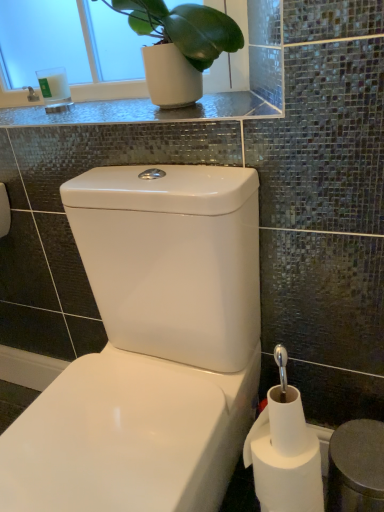
Describe the element at coordinates (55, 89) in the screenshot. I see `white glass candle at upper left` at that location.

You are a GUI agent. You are given a task and a screenshot of the screen. Output one action in this format:
    pyautogui.click(x=<x>, y=<y>)
    Task: Click on the white glossy toilet at center
    The width and height of the screenshot is (384, 512).
    Given the screenshot: What is the action you would take?
    pyautogui.click(x=150, y=347)

The width and height of the screenshot is (384, 512). Describe the element at coordinates (150, 347) in the screenshot. I see `white glossy toilet at center` at that location.

Locate an element on the screen. white matte toilet paper at lower right is located at coordinates click(284, 469).

Identify the location of white glass candle at upper left. (55, 89).

Between white matte toilet paper at lower right and green matte plant at upper left, which one has smaller size?

white matte toilet paper at lower right.

Considering the positions of objects white matte toilet paper at lower right and green matte plant at upper left in the image provided, who is behind, white matte toilet paper at lower right or green matte plant at upper left?

green matte plant at upper left is behind.

At what (x,y) coordinates should I click in order to perform the action: click on toilet paper on the right of green matte plant at upper left. Please return your answer as a coordinate pair (x, y). This screenshot has width=384, height=512. Looking at the image, I should click on (284, 469).

Looking at this image, considering the sizes of objects white glossy toilet at center and white glass candle at upper left in the image provided, who is wider, white glossy toilet at center or white glass candle at upper left?

With larger width is white glossy toilet at center.

Considering the relative positions of white glossy toilet at center and white glass candle at upper left in the image provided, is white glossy toilet at center to the right of white glass candle at upper left from the viewer's perspective?

Yes.

From a real-world perspective, which is physically above, white glossy toilet at center or white glass candle at upper left?

white glass candle at upper left is physically above.

Can you confirm if white glossy toilet at center is smaller than white glass candle at upper left?

No, white glossy toilet at center is not smaller than white glass candle at upper left.

Which of these two, white matte toilet paper at lower right or white glossy toilet at center, is smaller?

white matte toilet paper at lower right.

Relative to white glossy toilet at center, is white matte toilet paper at lower right in front or behind?

Visually, white matte toilet paper at lower right is located behind white glossy toilet at center.

From a real-world perspective, who is located lower, white matte toilet paper at lower right or white glossy toilet at center?

From a 3D spatial view, white matte toilet paper at lower right is below.

Is white glossy toilet at center at the back of shiny glass countertop at upper center?

That's not correct — shiny glass countertop at upper center is not looking away from white glossy toilet at center.

Does shiny glass countertop at upper center come behind white glossy toilet at center?

Yes, it is.

Do you think shiny glass countertop at upper center is within white glossy toilet at center, or outside of it?

shiny glass countertop at upper center is spatially situated outside white glossy toilet at center.

From the image's perspective, is shiny glass countertop at upper center located beneath white glossy toilet at center?

Actually, shiny glass countertop at upper center appears above white glossy toilet at center in the image.

From a real-world perspective, who is located higher, white glossy toilet at center or shiny glass countertop at upper center?

In real-world perspective, shiny glass countertop at upper center is above.

Which of these two, white glossy toilet at center or shiny glass countertop at upper center, stands shorter?

Standing shorter between the two is shiny glass countertop at upper center.

This screenshot has height=512, width=384. I want to click on counter top on the left of white glossy toilet at center, so click(134, 111).

Is point (80, 431) closer to camera compared to point (173, 116)?

Yes, it is.

Could you tell me if white matte toilet paper at lower right is turned towards white glass candle at upper left?

No, white matte toilet paper at lower right is not turned towards white glass candle at upper left.

Is white matte toilet paper at lower right in contact with white glass candle at upper left?

No.

Considering the sizes of objects white matte toilet paper at lower right and white glass candle at upper left in the image provided, who is thinner, white matte toilet paper at lower right or white glass candle at upper left?

white glass candle at upper left.

From a real-world perspective, which object stands above the other?

green matte plant at upper left is physically above.

Is point (257, 106) farther from camera compared to point (241, 34)?

No, it is not.

Is shiny glass countertop at upper center facing towards green matte plant at upper left?

No, shiny glass countertop at upper center is not oriented towards green matte plant at upper left.

Locate an element on the screen. The height and width of the screenshot is (512, 384). houseplant that is on the right side of shiny glass countertop at upper center is located at coordinates (181, 39).

Locate an element on the screen. This screenshot has height=512, width=384. houseplant on the left of white matte toilet paper at lower right is located at coordinates (181, 39).

Locate an element on the screen. toilet located on the right of white glass candle at upper left is located at coordinates (150, 347).

When comparing their distances from white matte toilet paper at lower right, does shiny glass countertop at upper center or green matte plant at upper left seem further?

green matte plant at upper left lies further to white matte toilet paper at lower right than the other object.

From the image, which object appears to be nearer to white glossy toilet at center, shiny glass countertop at upper center or white matte toilet paper at lower right?

Based on the image, white matte toilet paper at lower right appears to be nearer to white glossy toilet at center.

Considering their positions, is green matte plant at upper left positioned closer to white matte toilet paper at lower right than white glass candle at upper left?

green matte plant at upper left is closer to white matte toilet paper at lower right.

From the image, which object appears to be farther from white glass candle at upper left, green matte plant at upper left or white matte toilet paper at lower right?

white matte toilet paper at lower right lies further to white glass candle at upper left than the other object.

Which object lies nearer to the anchor point green matte plant at upper left, white glass candle at upper left or white matte toilet paper at lower right?

Among the two, white glass candle at upper left is located nearer to green matte plant at upper left.

Looking at the image, which one is located closer to white glossy toilet at center, shiny glass countertop at upper center or white glass candle at upper left?

shiny glass countertop at upper center.

Estimate the real-world distances between objects in this image. Which object is closer to white matte toilet paper at lower right, white glossy toilet at center or green matte plant at upper left?

white glossy toilet at center.

Which object lies nearer to the anchor point white matte toilet paper at lower right, white glossy toilet at center or shiny glass countertop at upper center?

white glossy toilet at center is closer to white matte toilet paper at lower right.

At what (x,y) coordinates should I click in order to perform the action: click on counter top between green matte plant at upper left and white glossy toilet at center in the vertical direction. Please return your answer as a coordinate pair (x, y). Looking at the image, I should click on (134, 111).

Where is `counter top between white glass candle at upper left and white matte toilet paper at lower right in the vertical direction`? counter top between white glass candle at upper left and white matte toilet paper at lower right in the vertical direction is located at coordinates (134, 111).

Identify the location of counter top that lies between white glass candle at upper left and white glossy toilet at center from top to bottom. Image resolution: width=384 pixels, height=512 pixels. (134, 111).

Locate an element on the screen. This screenshot has width=384, height=512. toiletry between green matte plant at upper left and white glossy toilet at center from top to bottom is located at coordinates (55, 89).